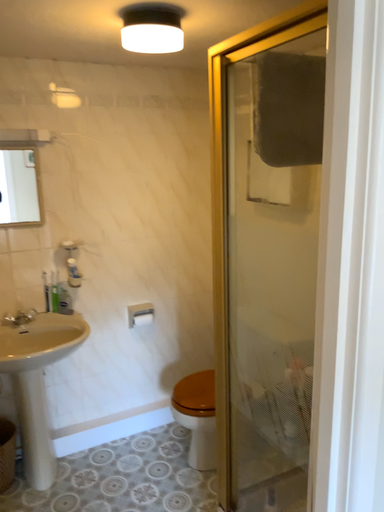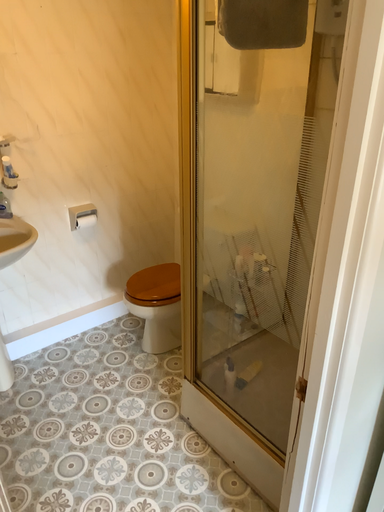
Question: Which way did the camera rotate in the video?

Choices:
 (A) rotated right
 (B) rotated left

Answer: (A)